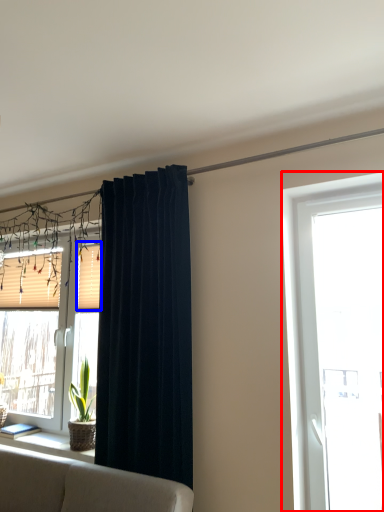
Question: Which object is closer to the camera taking this photo, window (highlighted by a red box) or shutter (highlighted by a blue box)?

Choices:
 (A) window
 (B) shutter

Answer: (A)